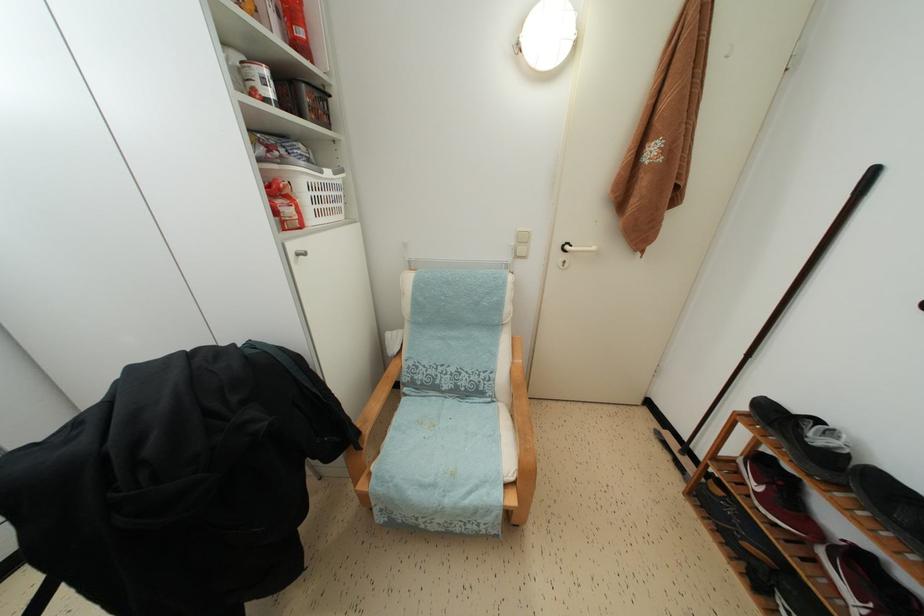
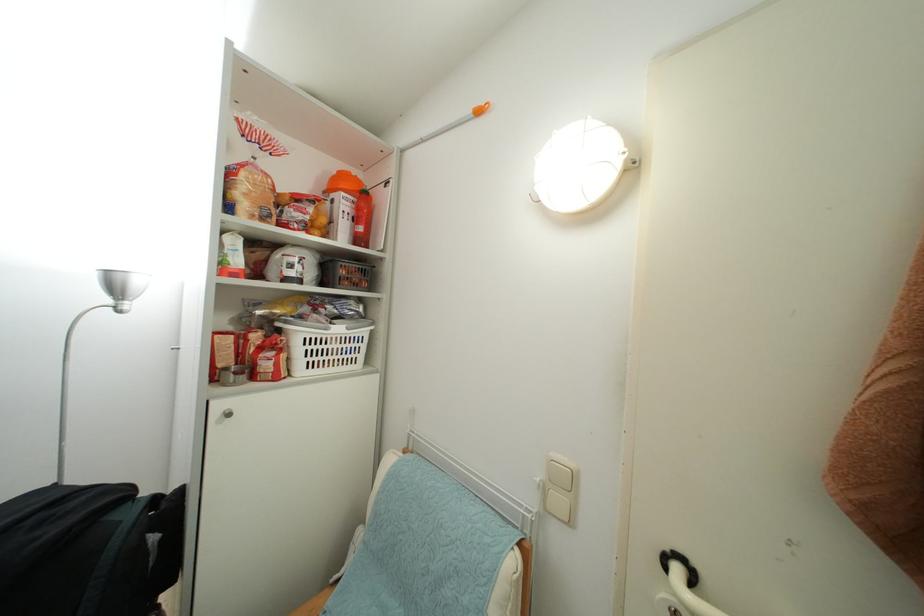
In the second image, find the point that corresponds to point (325, 177) in the first image.

(331, 334)